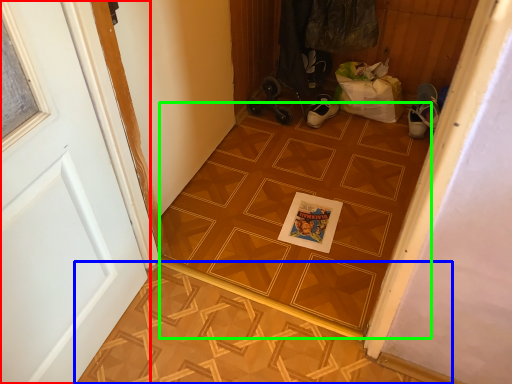
Question: Based on their relative distances, which object is nearer to door (highlighted by a red box)? Choose from tile (highlighted by a blue box) and ceramic tile (highlighted by a green box).

Choices:
 (A) tile
 (B) ceramic tile

Answer: (A)